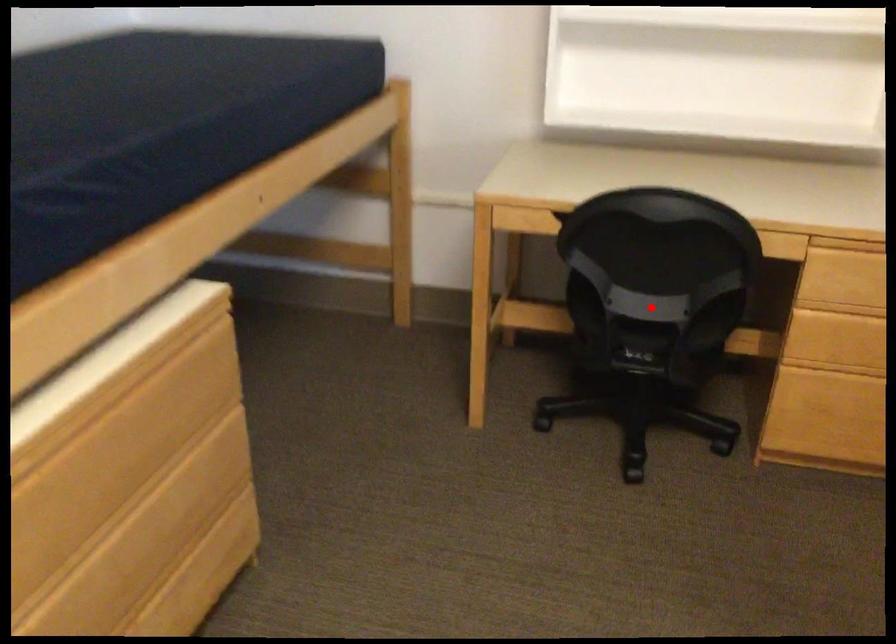
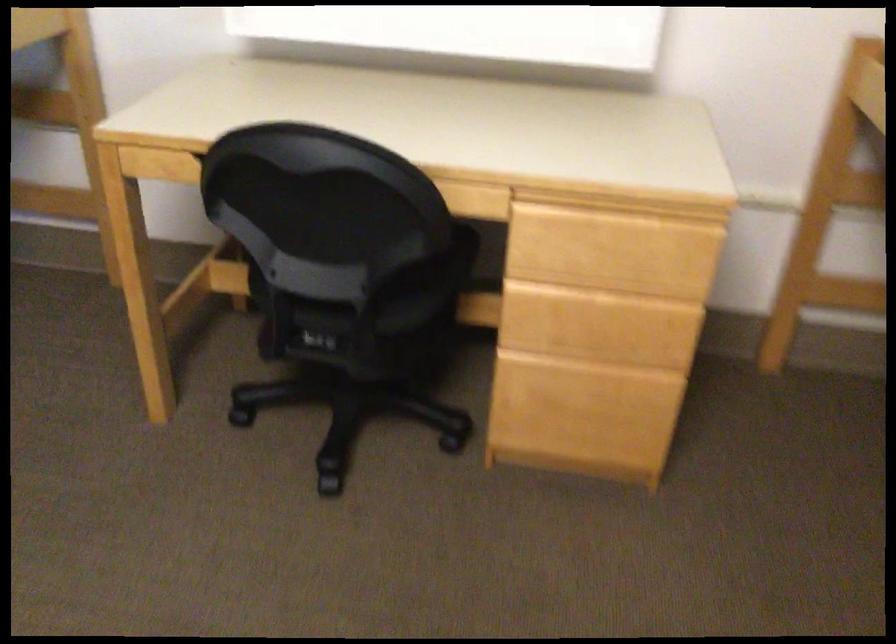
Question: I am providing you with two images of the same scene from different viewpoints. Image1 has a red point marked. In image2, the corresponding 3D location appears at what relative position? Reply with the corresponding letter.

Choices:
 (A) Closer
 (B) Farther

Answer: (A)